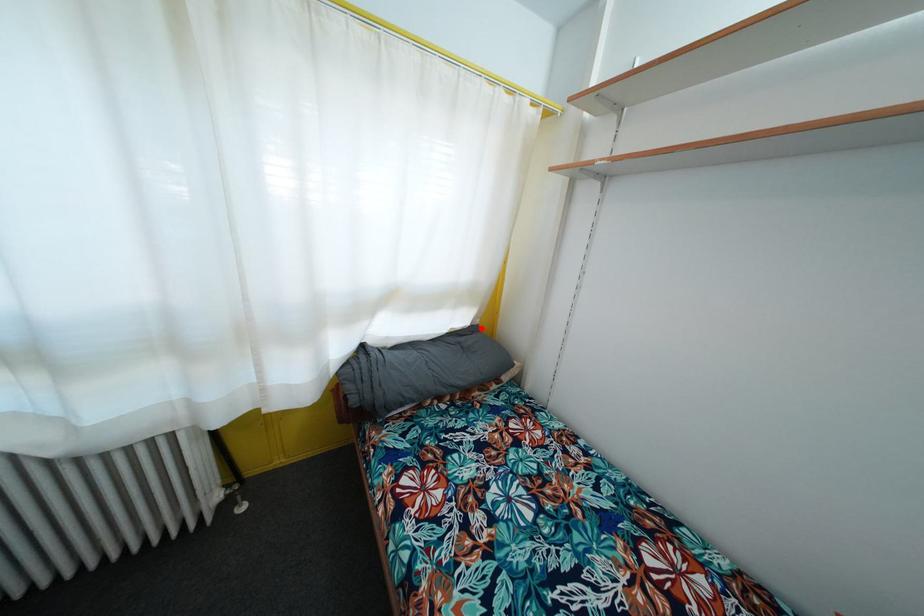
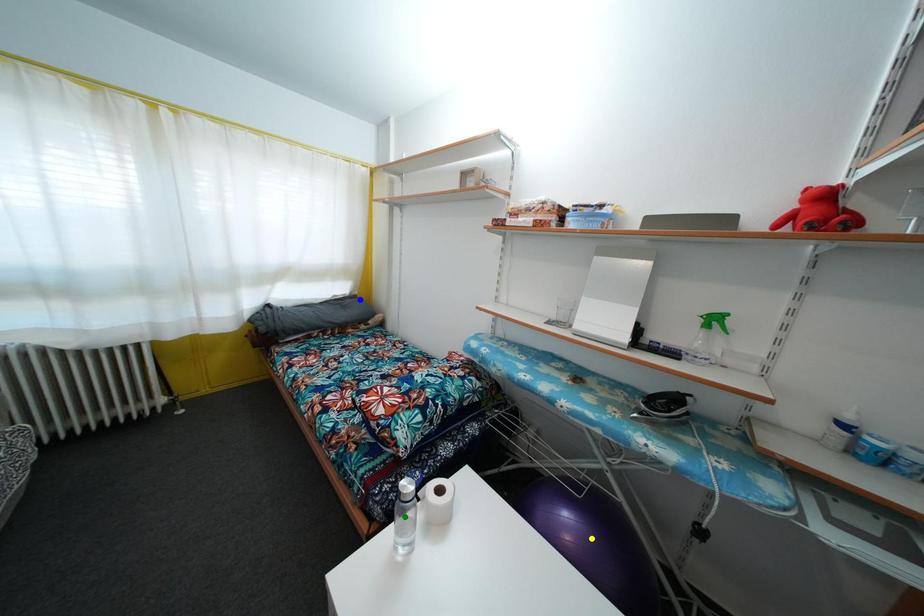
Question: I am providing you with two images of the same scene from different viewpoints. A red point is marked on the first image. You are given multiple points on the second image. In image 2, which mark is for the same physical point as the one in image 1?

Choices:
 (A) green point
 (B) blue point
 (C) yellow point

Answer: (B)